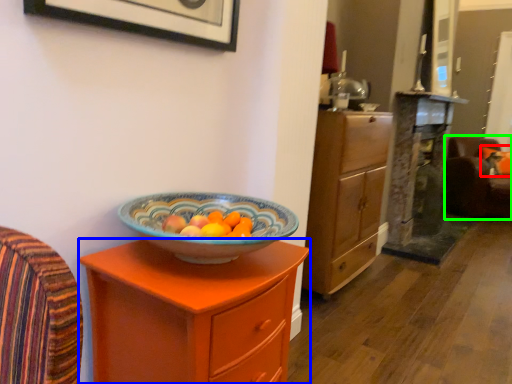
Question: Which object is positioned closest to pillow (highlighted by a red box)? Select from chest of drawers (highlighted by a blue box) and swivel chair (highlighted by a green box).

Choices:
 (A) chest of drawers
 (B) swivel chair

Answer: (B)